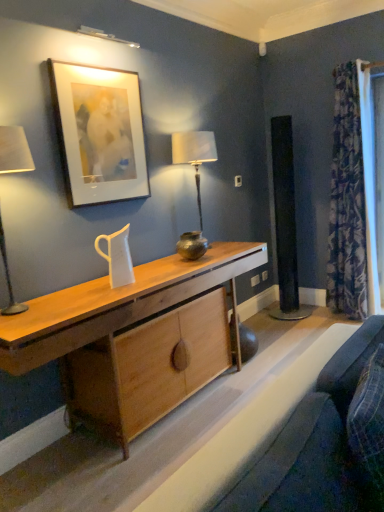
Question: Is matte white picture frame at upper left next to velvet blue swivel chair at lower right, the 2th swivel chair viewed from the right, and touching it?

Choices:
 (A) no
 (B) yes

Answer: (A)

Question: Is matte white picture frame at upper left completely or partially outside of velvet blue swivel chair at lower right, the 2th swivel chair viewed from the right?

Choices:
 (A) no
 (B) yes

Answer: (B)

Question: Does matte white picture frame at upper left have a greater width compared to velvet blue swivel chair at lower right, positioned as the 1th swivel chair in left-to-right order?

Choices:
 (A) no
 (B) yes

Answer: (A)

Question: From the image's perspective, is matte white picture frame at upper left below velvet blue swivel chair at lower right, the 2th swivel chair viewed from the right?

Choices:
 (A) yes
 (B) no

Answer: (B)

Question: Considering the relative sizes of matte white picture frame at upper left and velvet blue swivel chair at lower right, the 2th swivel chair viewed from the right, in the image provided, is matte white picture frame at upper left smaller than velvet blue swivel chair at lower right, the 2th swivel chair viewed from the right,?

Choices:
 (A) yes
 (B) no

Answer: (A)

Question: Does matte white picture frame at upper left come behind velvet blue swivel chair at lower right, the 2th swivel chair viewed from the right?

Choices:
 (A) yes
 (B) no

Answer: (A)

Question: Does natural wood desk at center have a lesser height compared to shiny metallic vase at center?

Choices:
 (A) no
 (B) yes

Answer: (A)

Question: Could shiny metallic vase at center be considered to be inside natural wood desk at center?

Choices:
 (A) yes
 (B) no

Answer: (B)

Question: Considering the relative positions of natural wood desk at center and shiny metallic vase at center in the image provided, is natural wood desk at center to the right of shiny metallic vase at center from the viewer's perspective?

Choices:
 (A) no
 (B) yes

Answer: (A)

Question: Is natural wood desk at center positioned beyond the bounds of shiny metallic vase at center?

Choices:
 (A) no
 (B) yes

Answer: (B)

Question: Is natural wood desk at center further to camera compared to shiny metallic vase at center?

Choices:
 (A) no
 (B) yes

Answer: (A)

Question: Is natural wood desk at center wider than shiny metallic vase at center?

Choices:
 (A) yes
 (B) no

Answer: (A)

Question: Is metallic silver table lamp at center closer to the viewer compared to velvet blue cushion at lower right, the 2th swivel chair when ordered from left to right?

Choices:
 (A) no
 (B) yes

Answer: (A)